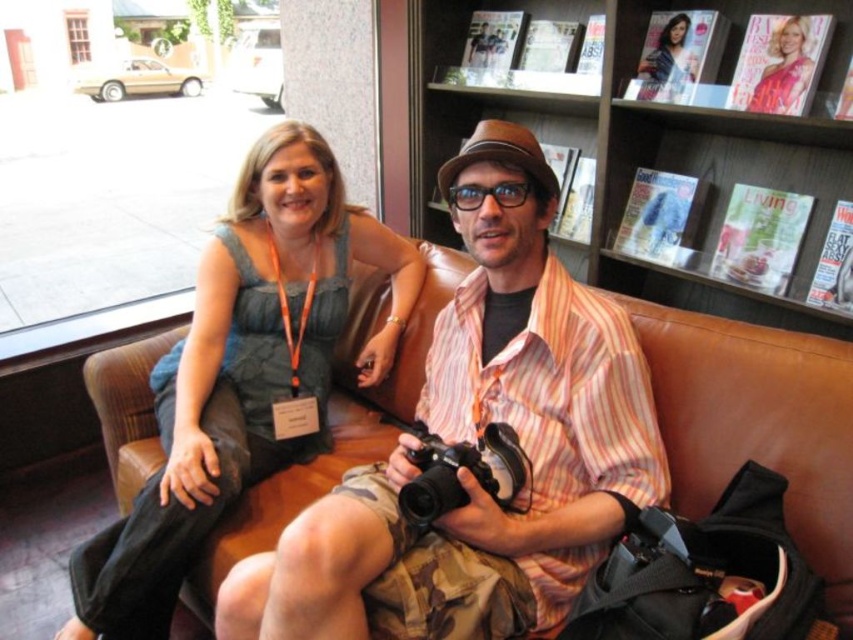
You are a photographer trying to capture the brown leather couch at center in a wide shot. Your camera has a field of view that can cover an area from point A to point B. Given that the point you marked at [757,422] represents the center of the couch, would your camera be able to include the entire couch in the frame if you position it directly facing the couch from a distance of 3 meters?

The point at [757,422] marks the center of the brown leather couch at center. Since the camera is positioned 3 meters away and facing the couch directly, it should be able to capture the entire couch within the frame, assuming the field of view covers the necessary area around the center point.

You are a photographer trying to capture a candid shot of the two people on the brown leather couch. The matte green dress at center is blocking your view. Can you estimate the position of the dress to adjust your angle? Please provide coordinates based on the image grid where the dress is located.

The matte green dress at center is located at point coordinates (242, 372), so you should adjust your angle to avoid this position to capture the two people clearly.